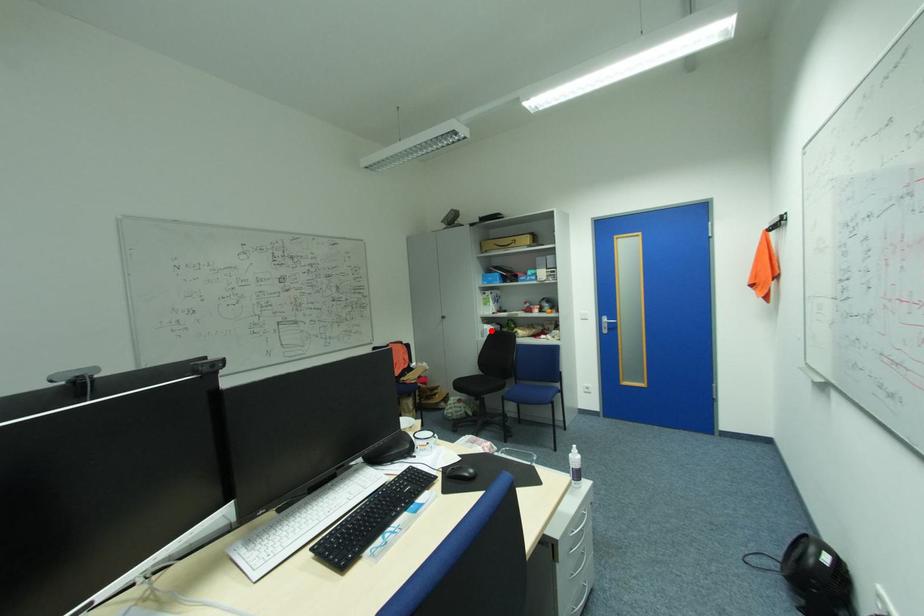
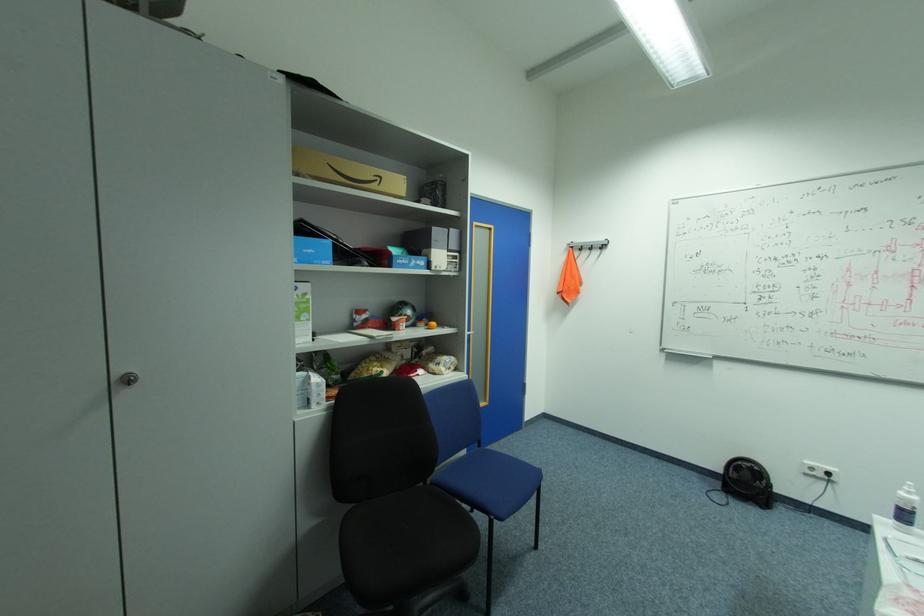
In the second image, find the point that corresponds to the highlighted location in the first image.

(321, 387)